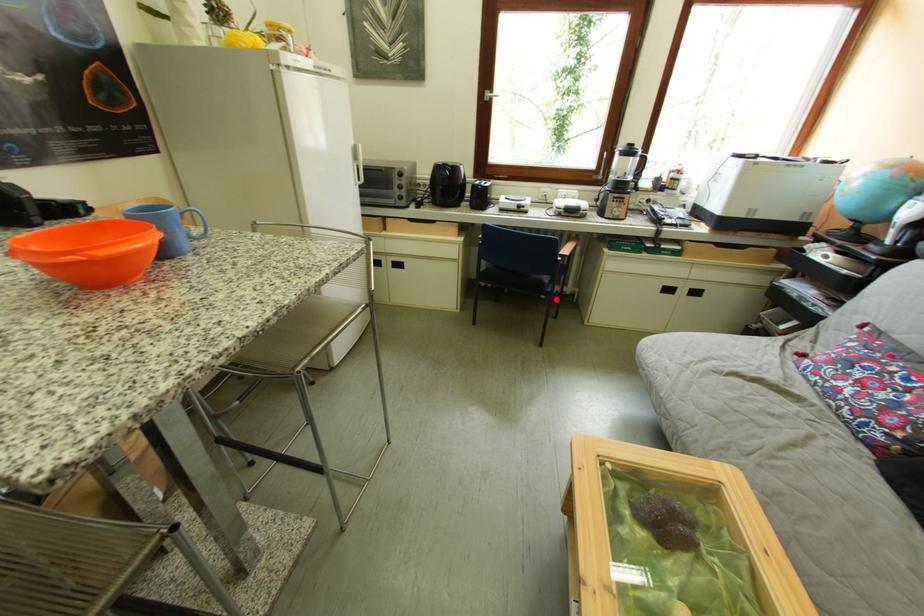
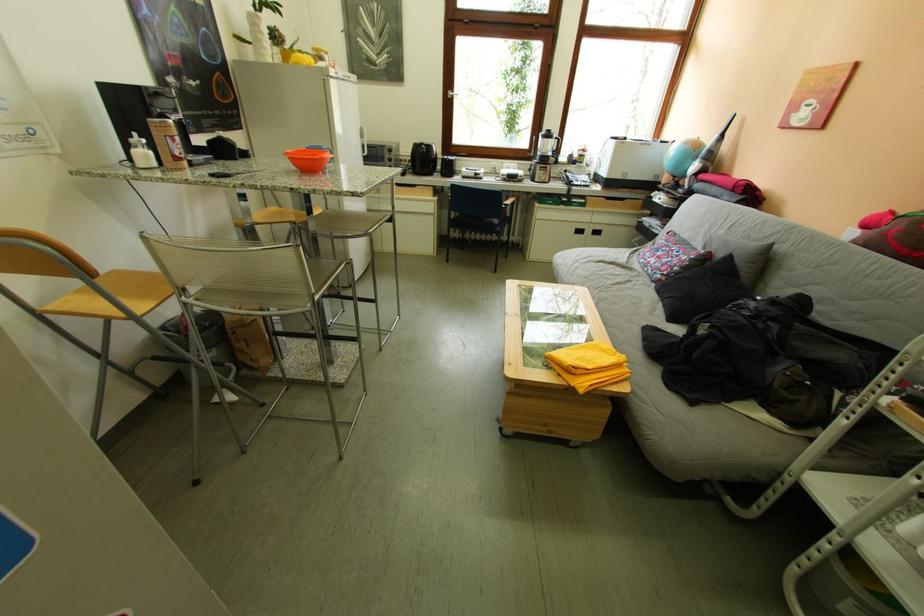
Find the pixel in the second image that matches the highlighted location in the first image.

(507, 238)